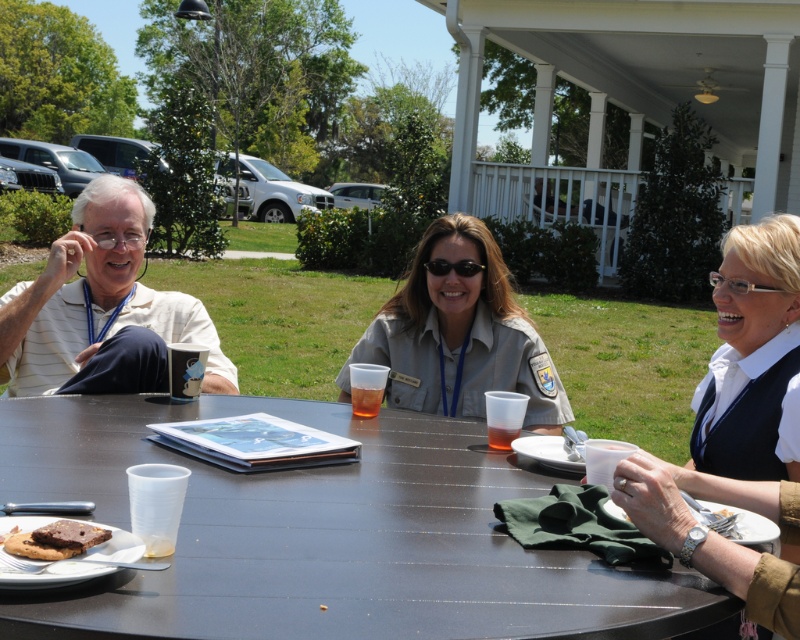
In the scene shown: Which of these two, khaki uniform at center or translucent plastic cup at center, stands taller?

khaki uniform at center is taller.

Can you confirm if khaki uniform at center is shorter than translucent plastic cup at center?

In fact, khaki uniform at center may be taller than translucent plastic cup at center.

Which is behind, point (438, 282) or point (508, 428)?

The point (438, 282) is behind.

Locate an element on the screen. khaki uniform at center is located at coordinates (458, 336).

Does white wooden porch at upper center come in front of matte brownie at lower left?

No, it is not.

Identify the location of white wooden porch at upper center. (560, 200).

Is white matte vest at right below translucent plastic cup at table center?

Incorrect, white matte vest at right is not positioned below translucent plastic cup at table center.

Can you confirm if white matte vest at right is positioned to the right of translucent plastic cup at table center?

Yes, white matte vest at right is to the right of translucent plastic cup at table center.

Who is more forward, (734, 317) or (376, 403)?

Point (734, 317)

Image resolution: width=800 pixels, height=640 pixels. I want to click on white matte vest at right, so click(750, 369).